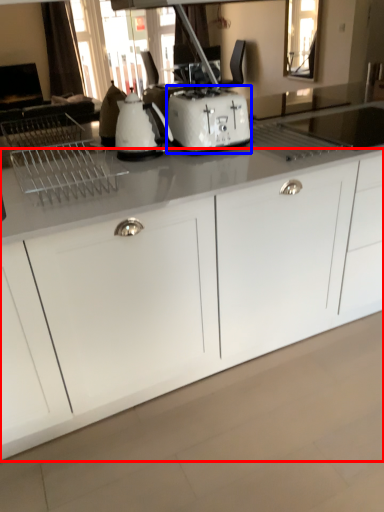
Question: Which object is further to the camera taking this photo, cabinetry (highlighted by a red box) or toaster (highlighted by a blue box)?

Choices:
 (A) cabinetry
 (B) toaster

Answer: (B)